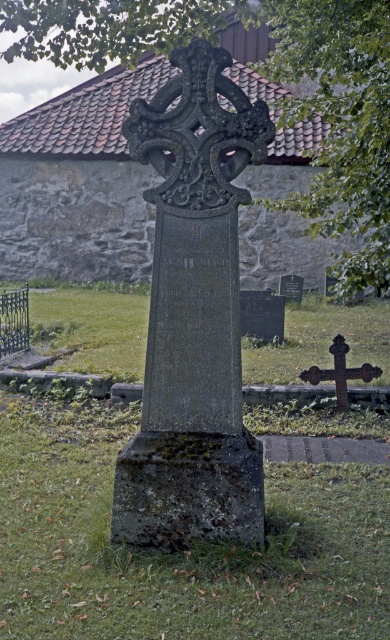
Is green leafy tree at upper center shorter than rusty metal cross at lower right?

Indeed, green leafy tree at upper center has a lesser height compared to rusty metal cross at lower right.

Is green leafy tree at upper center positioned behind rusty metal cross at lower right?

No, it is not.

Which is behind, point (359, 262) or point (301, 374)?

Point (301, 374)

Locate an element on the screen. The height and width of the screenshot is (640, 390). green leafy tree at upper center is located at coordinates (269, 80).